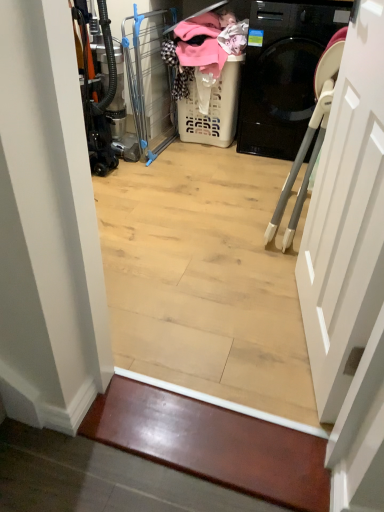
You are a GUI agent. You are given a task and a screenshot of the screen. Output one action in this format:
    pyautogui.click(x=<x>, y=<y>)
    Task: Click on the vacant space in between white matte door at right and white plastic laundry basket at center
    The image size is (384, 512).
    Given the screenshot: What is the action you would take?
    pyautogui.click(x=239, y=208)